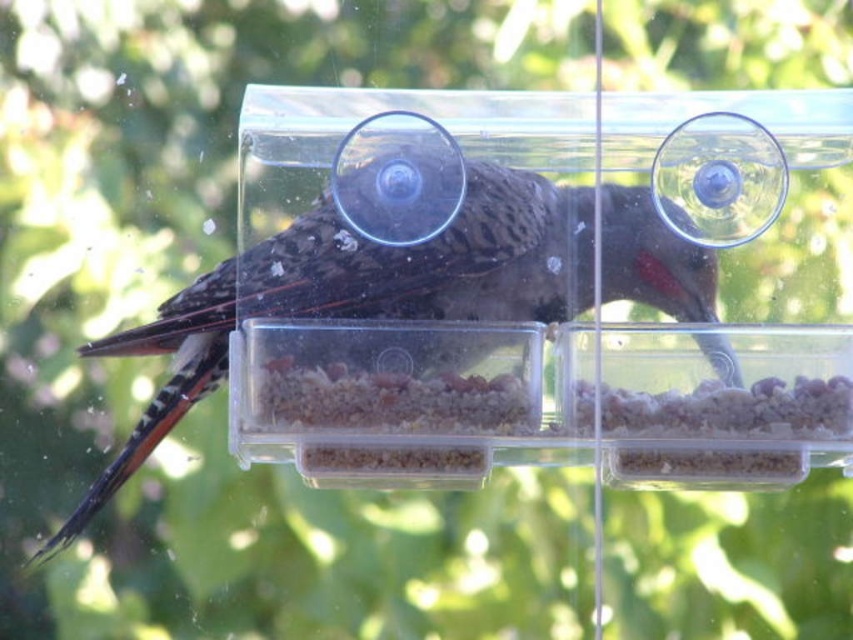
Does point (440, 276) lie in front of point (380, 436)?

No, it is behind (380, 436).

Measure the distance between speckled feathered bird at center and camera.

The distance of speckled feathered bird at center from camera is 21.13 inches.

What are the coordinates of `speckled feathered bird at center` in the screenshot? It's located at (416, 285).

Can you confirm if speckled feathered bird at center is positioned to the left of white granular food at lower right?

Correct, you'll find speckled feathered bird at center to the left of white granular food at lower right.

Based on the photo, can you confirm if speckled feathered bird at center is smaller than white granular food at lower right?

No, speckled feathered bird at center is not smaller than white granular food at lower right.

Does point (109, 476) come closer to viewer compared to point (677, 433)?

No, it is behind (677, 433).

Locate an element on the screen. Image resolution: width=853 pixels, height=640 pixels. speckled feathered bird at center is located at coordinates (416, 285).

Does brown grainy seeds at center appear on the left side of white granular food at lower right?

Indeed, brown grainy seeds at center is positioned on the left side of white granular food at lower right.

Does brown grainy seeds at center have a smaller size compared to white granular food at lower right?

Correct, brown grainy seeds at center occupies less space than white granular food at lower right.

Which is in front, point (380, 422) or point (791, 445)?

Point (380, 422) is in front.

Locate an element on the screen. The height and width of the screenshot is (640, 853). brown grainy seeds at center is located at coordinates (392, 417).